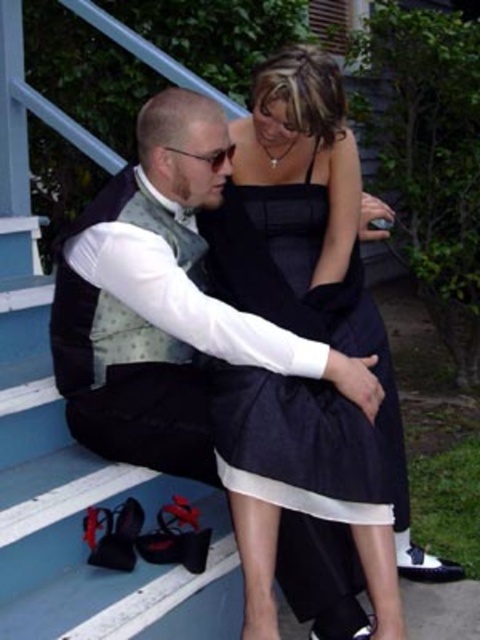
You are standing at the bottom of the blue stairs and want to place a small decoration at the point that is in front. Which point should you choose between point [392,428] and point [310,531]?

Point [310,531] is in front of point [392,428], so you should choose point [310,531] to place the decoration.

You are organizing a costume party and need to arrange the black satin vest at center and the white leather shoe at lower right for display. According to the image, which object should be placed to the left when setting them up?

The black satin vest at center should be placed to the left of the white leather shoe at lower right because in the image, the black satin vest at center is to the left of the white leather shoe at lower right.

Looking at this image, where is the black satin vest at center located in the image?

The black satin vest at center is located at point (164, 305).